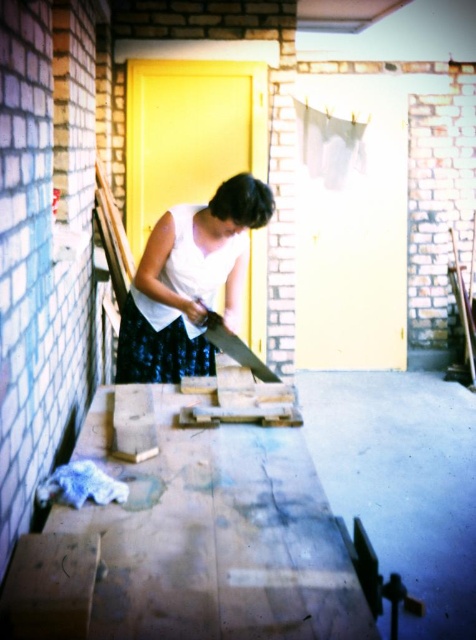
Is the position of smooth wooden plank at lower center more distant than that of metallic saw at center?

No, smooth wooden plank at lower center is closer to the viewer.

Is point (348, 588) positioned before point (267, 368)?

Yes, point (348, 588) is closer to viewer.

Measure the distance between point (277, 518) and camera.

Point (277, 518) and camera are 1.47 meters apart.

The height and width of the screenshot is (640, 476). What are the coordinates of `smooth wooden plank at lower center` in the screenshot? It's located at (191, 545).

Does smooth wooden plank at lower center come behind white matte dress at center?

No, it is not.

Based on the photo, does smooth wooden plank at lower center appear on the right side of white matte dress at center?

Correct, you'll find smooth wooden plank at lower center to the right of white matte dress at center.

At what (x,y) coordinates should I click in order to perform the action: click on smooth wooden plank at lower center. Please return your answer as a coordinate pair (x, y). Image resolution: width=476 pixels, height=640 pixels. Looking at the image, I should click on coord(191,545).

Locate an element on the screen. Image resolution: width=476 pixels, height=640 pixels. smooth wooden plank at lower center is located at coordinates (191, 545).

Does white matte dress at center have a greater width compared to metallic saw at center?

Yes, white matte dress at center is wider than metallic saw at center.

Between white matte dress at center and metallic saw at center, which one is positioned higher?

Positioned higher is white matte dress at center.

Is point (188, 234) behind point (231, 346)?

No, (188, 234) is in front of (231, 346).

Where is `white matte dress at center`? white matte dress at center is located at coordinates (188, 282).